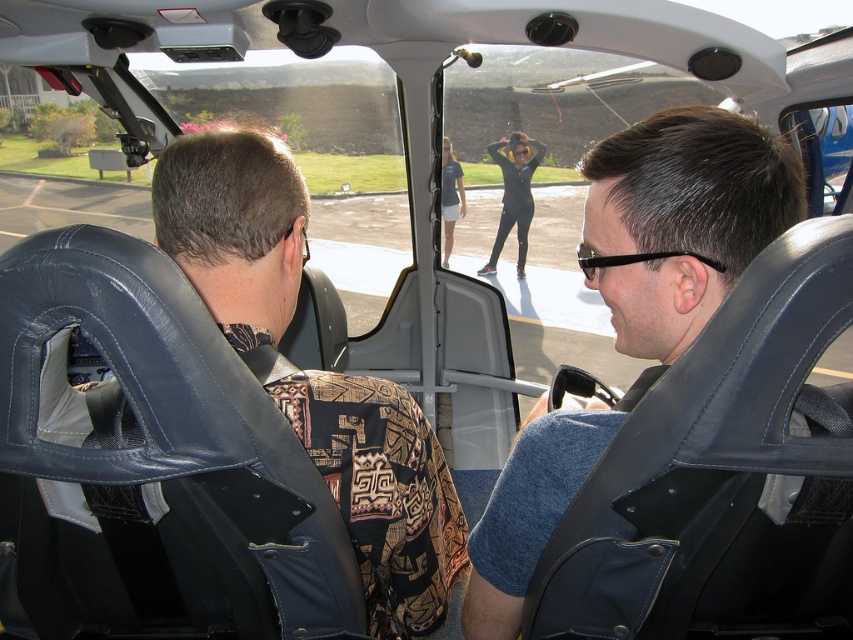
You are a GUI agent. You are given a task and a screenshot of the screen. Output one action in this format:
    pyautogui.click(x=<x>, y=<y>)
    Task: Click on the matte black seat at left
    
    Given the screenshot: What is the action you would take?
    pyautogui.click(x=383, y=492)

Does matte black seat at left have a greater height compared to black matte pants at center?

Incorrect, matte black seat at left's height is not larger of black matte pants at center's.

The width and height of the screenshot is (853, 640). I want to click on matte black seat at left, so click(383, 492).

This screenshot has width=853, height=640. In order to click on matte black seat at left in this screenshot , I will do `click(383, 492)`.

Does blue fabric shirt at center have a lesser width compared to matte black seat at left?

Incorrect, blue fabric shirt at center's width is not less than matte black seat at left's.

Can you confirm if blue fabric shirt at center is positioned to the left of matte black seat at left?

Incorrect, blue fabric shirt at center is not on the left side of matte black seat at left.

I want to click on blue fabric shirt at center, so click(635, 308).

Find the location of a particular element. blue fabric shirt at center is located at coordinates (635, 308).

The image size is (853, 640). What do you see at coordinates (635, 308) in the screenshot?
I see `blue fabric shirt at center` at bounding box center [635, 308].

Does blue fabric shirt at center appear on the right side of black matte pants at center?

In fact, blue fabric shirt at center is to the left of black matte pants at center.

Image resolution: width=853 pixels, height=640 pixels. Find the location of `blue fabric shirt at center`. blue fabric shirt at center is located at coordinates (635, 308).